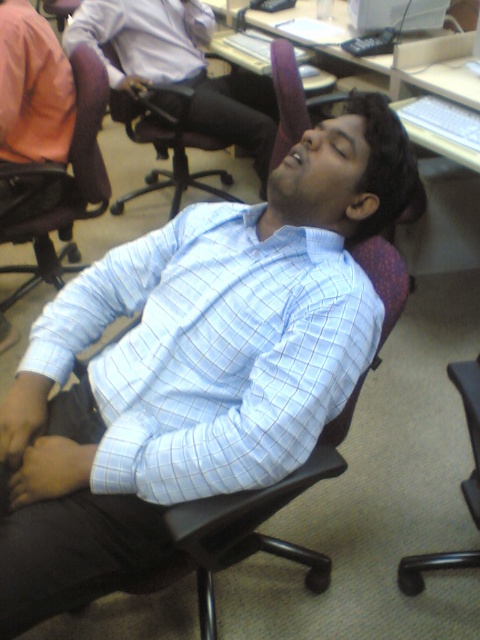
Which is in front, point (157, 81) or point (179, 67)?

Point (157, 81)

Which is more to the right, matte black laptop at upper center or matte white shirt at upper center?

matte black laptop at upper center

Between point (96, 29) and point (139, 22), which one is positioned behind?

The point (139, 22) is behind.

Locate an element on the screen. The height and width of the screenshot is (640, 480). matte black laptop at upper center is located at coordinates (178, 67).

The width and height of the screenshot is (480, 640). What do you see at coordinates (394, 60) in the screenshot?
I see `white glossy computer desk at upper center` at bounding box center [394, 60].

Which of these two, white glossy computer desk at upper center or matte white shirt at upper center, stands shorter?

matte white shirt at upper center

Locate an element on the screen. This screenshot has height=640, width=480. white glossy computer desk at upper center is located at coordinates (394, 60).

Does matte black laptop at upper center have a larger size compared to brown leather chair at left?

Yes, matte black laptop at upper center is bigger than brown leather chair at left.

Between matte black laptop at upper center and brown leather chair at left, which one appears on the right side from the viewer's perspective?

matte black laptop at upper center is more to the right.

Looking at this image, measure the distance between point (x=178, y=81) and camera.

They are 8.77 feet apart.

You are a GUI agent. You are given a task and a screenshot of the screen. Output one action in this format:
    pyautogui.click(x=<x>, y=<y>)
    Task: Click on the matte black laptop at upper center
    The width and height of the screenshot is (480, 640).
    Given the screenshot: What is the action you would take?
    pyautogui.click(x=178, y=67)